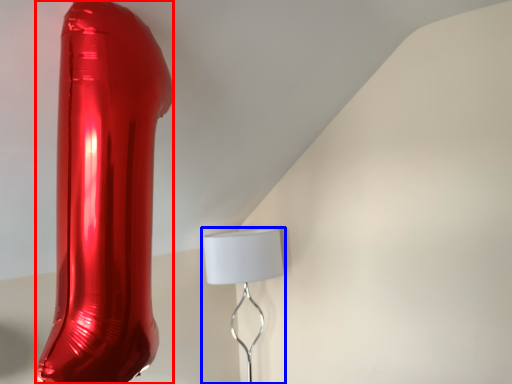
Question: Which point is closer to the camera, glass vase (highlighted by a red box) or lamp (highlighted by a blue box)?

Choices:
 (A) glass vase
 (B) lamp

Answer: (A)